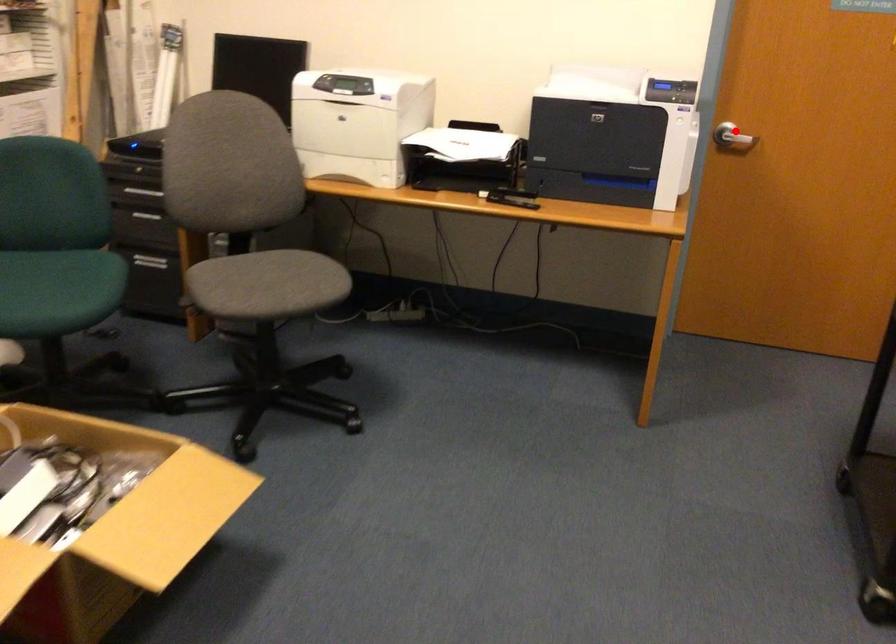
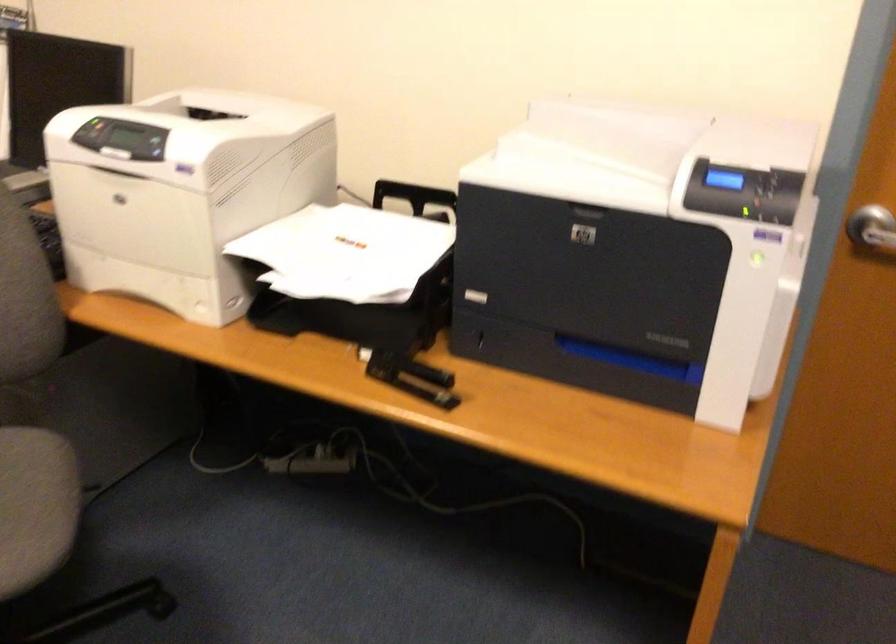
Question: A red point is marked in image1. In image2, is the corresponding 3D point closer to the camera or farther? Reply with the corresponding letter.

Choices:
 (A) The corresponding 3D point is closer.
 (B) The corresponding 3D point is farther.

Answer: (A)